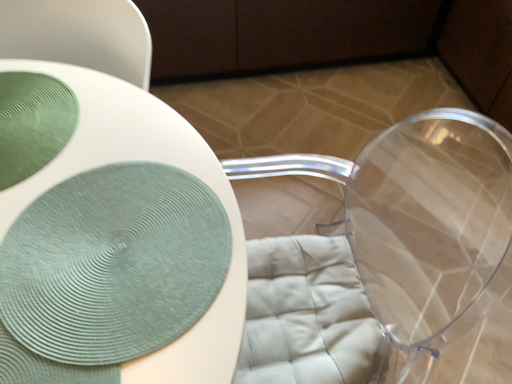
Locate an element on the screen. The height and width of the screenshot is (384, 512). vacant area that lies to the right of green textured plate at upper left is located at coordinates (127, 167).